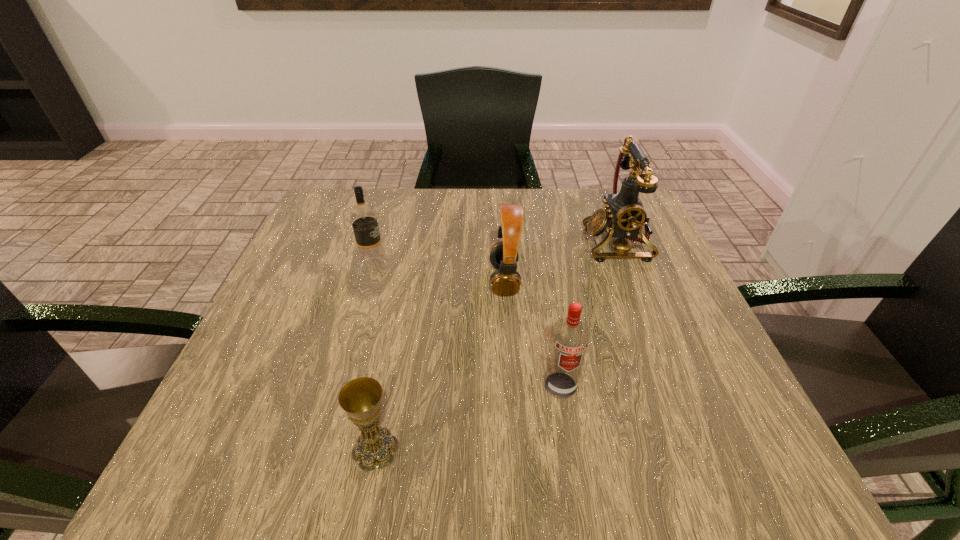
Find the location of a particular element. free space that is in between the leftmost object and the nearer vodka is located at coordinates (467, 326).

Where is `vacant space that's between the shortest object and the farther vodka`? vacant space that's between the shortest object and the farther vodka is located at coordinates (374, 357).

Locate an element on the screen. free space that is in between the second object from left to right and the leftmost object is located at coordinates (374, 357).

The width and height of the screenshot is (960, 540). I want to click on free area in between the nearest object and the farther vodka, so click(x=374, y=357).

The height and width of the screenshot is (540, 960). I want to click on vacant area that lies between the tallest object and the right vodka, so click(589, 314).

Locate an element on the screen. The image size is (960, 540). free spot between the right vodka and the headset is located at coordinates (533, 333).

This screenshot has width=960, height=540. I want to click on vacant area that lies between the headset and the telephone, so click(x=561, y=261).

Identify which object is the second nearest to the tallest object. Please provide its 2D coordinates. Your answer should be formatted as a tuple, i.e. [(x, y)], where the tuple contains the x and y coordinates of a point satisfying the conditions above.

[(569, 339)]

In order to click on object that can be found as the third closest to the headset in this screenshot , I will do `click(364, 221)`.

I want to click on vacant area that satisfies the following two spatial constraints: 1. on the front of the rightmost object, featuring the rotary dial; 2. on the front side of the shortest object, so click(699, 449).